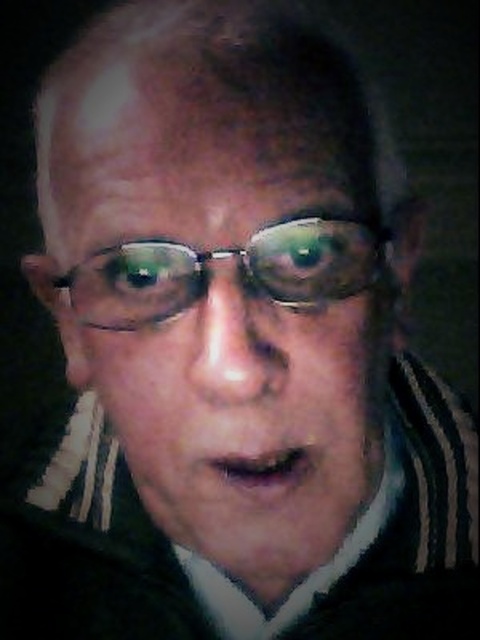
Can you confirm if matte black face at center is positioned to the left of clear plastic glasses at center?

Incorrect, matte black face at center is not on the left side of clear plastic glasses at center.

Is matte black face at center positioned in front of clear plastic glasses at center?

Yes, it is in front of clear plastic glasses at center.

Is point (155, 278) positioned after point (120, 246)?

Yes, it is.

Identify the location of matte black face at center. (224, 333).